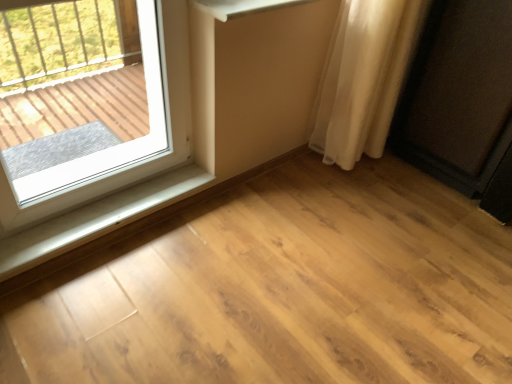
Question: Is white plastic window sill at lower left facing away from matte black speaker at right?

Choices:
 (A) no
 (B) yes

Answer: (A)

Question: Is white plastic window sill at lower left at the left side of matte black speaker at right?

Choices:
 (A) yes
 (B) no

Answer: (A)

Question: Considering the relative sizes of white plastic window sill at lower left and matte black speaker at right in the image provided, is white plastic window sill at lower left thinner than matte black speaker at right?

Choices:
 (A) yes
 (B) no

Answer: (A)

Question: Is white plastic window sill at lower left positioned before matte black speaker at right?

Choices:
 (A) no
 (B) yes

Answer: (A)

Question: Can you see white plastic window sill at lower left touching matte black speaker at right?

Choices:
 (A) yes
 (B) no

Answer: (B)

Question: Is white plastic window sill at lower left wider than matte black speaker at right?

Choices:
 (A) yes
 (B) no

Answer: (B)

Question: Is white sheer curtain at right oriented towards matte black speaker at right?

Choices:
 (A) yes
 (B) no

Answer: (B)

Question: Would you consider white sheer curtain at right to be distant from matte black speaker at right?

Choices:
 (A) yes
 (B) no

Answer: (B)

Question: Does white sheer curtain at right have a larger size compared to matte black speaker at right?

Choices:
 (A) no
 (B) yes

Answer: (A)

Question: Does white sheer curtain at right have a lesser width compared to matte black speaker at right?

Choices:
 (A) no
 (B) yes

Answer: (B)

Question: Considering the relative positions of white sheer curtain at right and matte black speaker at right in the image provided, is white sheer curtain at right to the left of matte black speaker at right from the viewer's perspective?

Choices:
 (A) yes
 (B) no

Answer: (A)

Question: Does white sheer curtain at right lie behind matte black speaker at right?

Choices:
 (A) yes
 (B) no

Answer: (A)

Question: Is white plastic window at upper left facing towards matte black speaker at right?

Choices:
 (A) no
 (B) yes

Answer: (A)